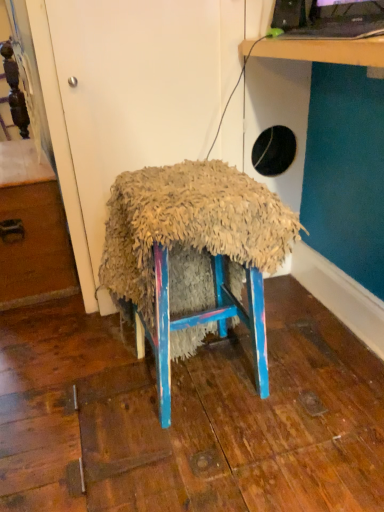
Where is `free location above fuzzy fabric stool at center (from a real-world perspective)`? The width and height of the screenshot is (384, 512). free location above fuzzy fabric stool at center (from a real-world perspective) is located at coordinates (188, 180).